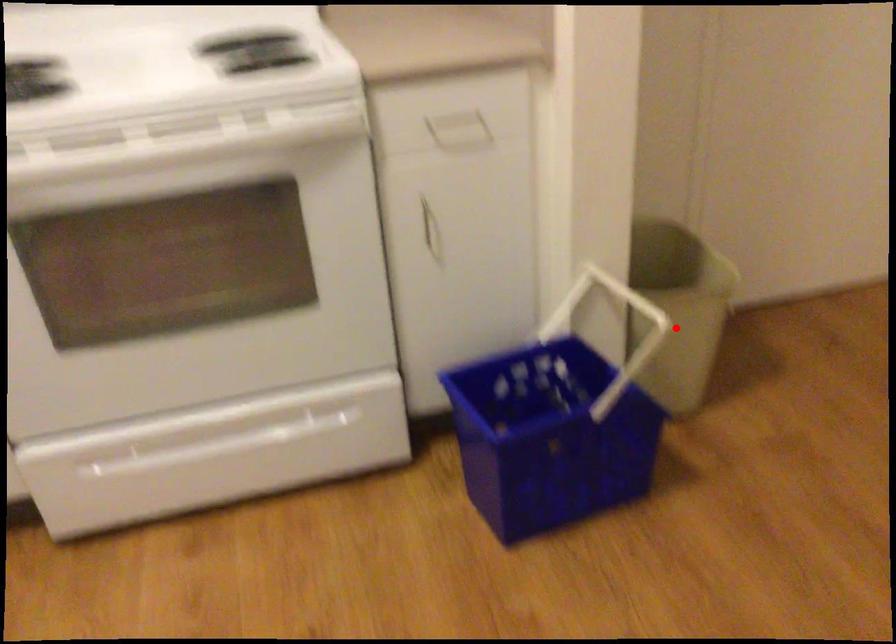
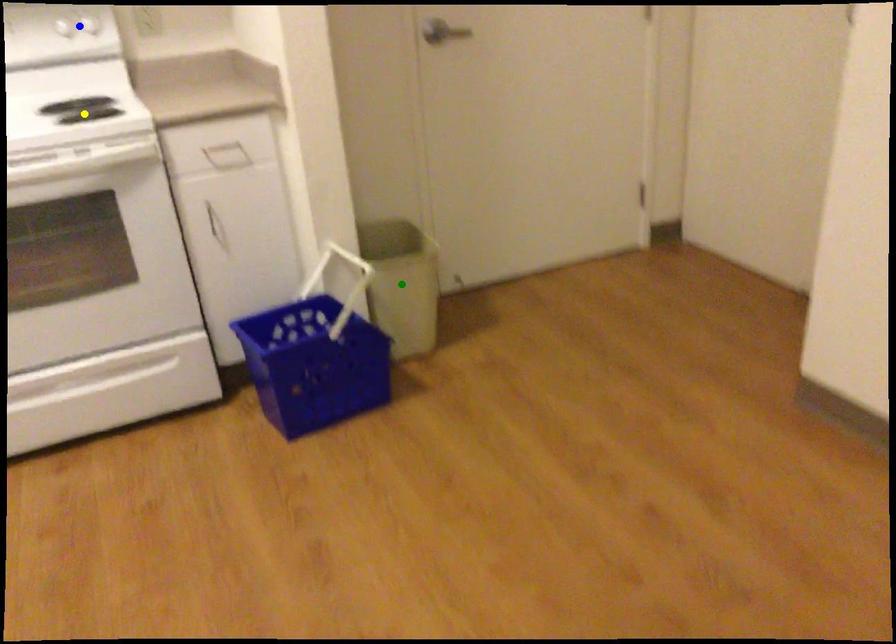
Question: I am providing you with two images of the same scene from different viewpoints. A red point is marked on the first image. You are given multiple points on the second image. Which point in image 2 is actually the same real-world point as the red point in image 1?

Choices:
 (A) green point
 (B) blue point
 (C) yellow point

Answer: (A)